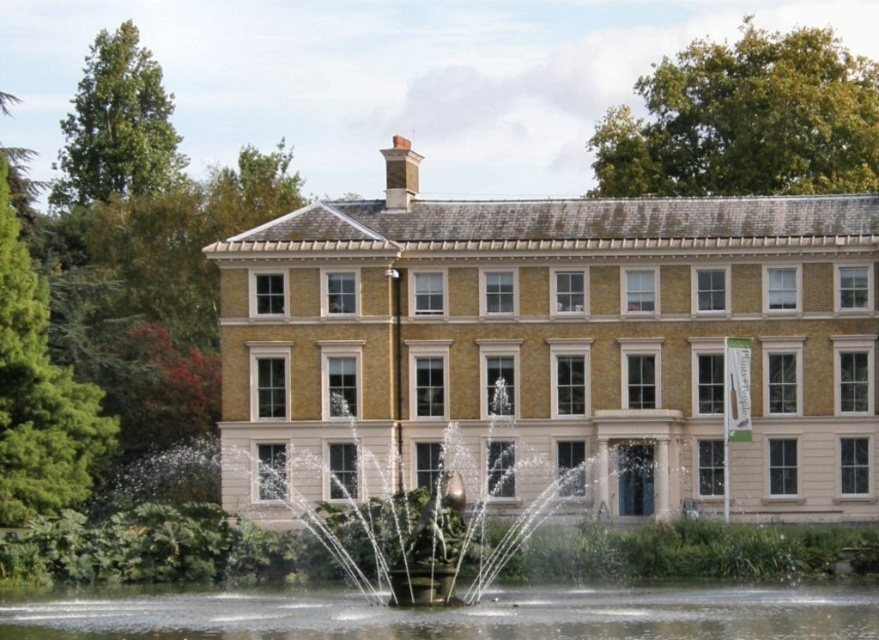
Based on the photo, you are a tour guide leading a group of visitors. You want to inform them about the distance between the beige stone mansion at center and the bronze fountain at center. What would you tell them?

The distance between the beige stone mansion at center and the bronze fountain at center is 7.19 meters.

You are standing in front of the grand building and see the clear water at center and the bronze fountain at center. Which object is positioned lower relative to the other?

The clear water at center is positioned lower than the bronze fountain at center because it is located below it.

You are standing in front of the building and notice two points marked in the image. Which point is closer to you, point 1 at coordinates (425,308) or point 2 at coordinates (836,611)?

Point 1 at coordinates (425,308) is closer to you because it is further to the viewer than point 2 at coordinates (836,611).